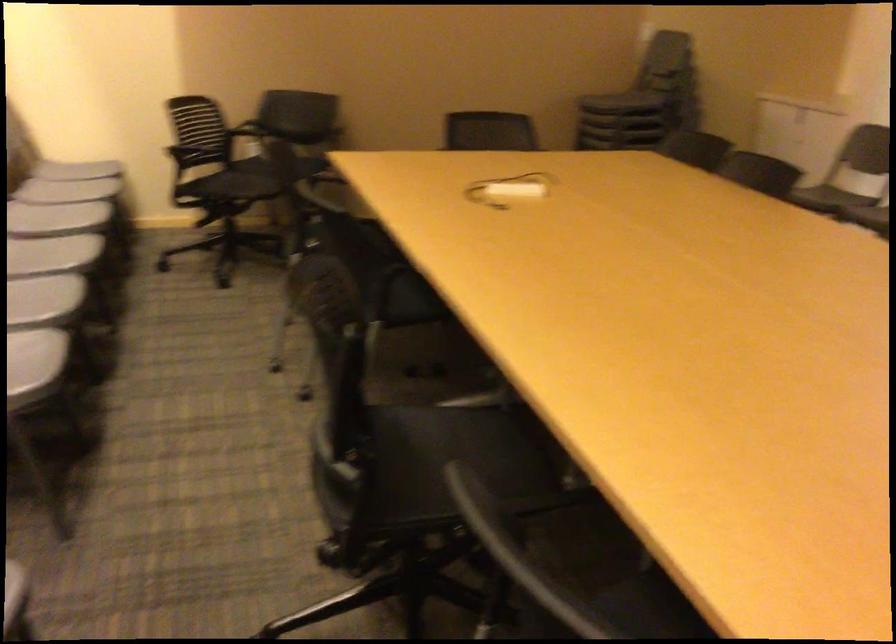
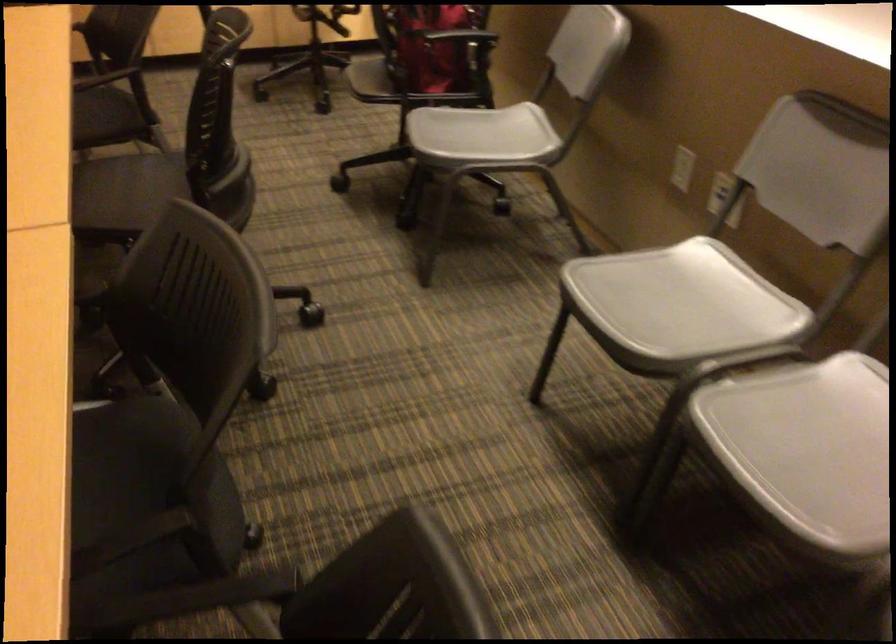
Locate, in the second image, the point that corresponds to [449,252] in the first image.

(130, 427)